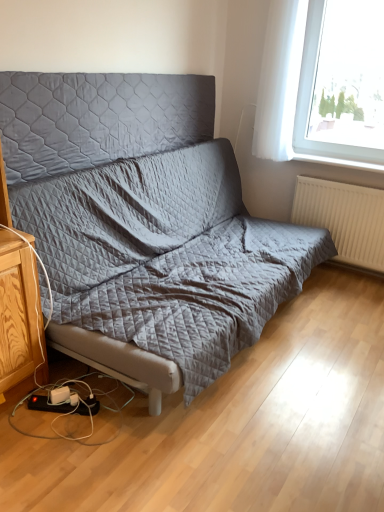
The height and width of the screenshot is (512, 384). What are the coordinates of `white sheer curtain at upper right` in the screenshot? It's located at (279, 80).

Describe the element at coordinates (344, 218) in the screenshot. I see `white textured radiator at right` at that location.

Based on the photo, what is the approximate width of quilted fabric headboard at upper center?

The width of quilted fabric headboard at upper center is 2.46 inches.

This screenshot has height=512, width=384. In order to click on quilted fabric headboard at upper center in this screenshot , I will do coord(98,118).

This screenshot has width=384, height=512. What do you see at coordinates (146, 216) in the screenshot? I see `quilted fabric studio couch at center` at bounding box center [146, 216].

What are the coordinates of `transparent glass window at upper right` in the screenshot? It's located at (296, 91).

Where is `studio couch above the black plastic power strip at lower left (from the image's perspective)`? This screenshot has height=512, width=384. studio couch above the black plastic power strip at lower left (from the image's perspective) is located at coordinates (146, 216).

Considering the relative positions of quilted fabric studio couch at center and black plastic power strip at lower left in the image provided, is quilted fabric studio couch at center to the left or to the right of black plastic power strip at lower left?

Based on their positions, quilted fabric studio couch at center is located to the right of black plastic power strip at lower left.

Looking at this image, from the image's perspective, is quilted fabric studio couch at center located above black plastic power strip at lower left?

Indeed, from the image's perspective, quilted fabric studio couch at center is shown above black plastic power strip at lower left.

Between white sheer curtain at upper right and quilted fabric studio couch at center, which one has larger size?

quilted fabric studio couch at center.

Considering the sizes of objects white sheer curtain at upper right and quilted fabric studio couch at center in the image provided, who is shorter, white sheer curtain at upper right or quilted fabric studio couch at center?

quilted fabric studio couch at center.

Would you say white sheer curtain at upper right is outside quilted fabric studio couch at center?

Absolutely, white sheer curtain at upper right is external to quilted fabric studio couch at center.

The width and height of the screenshot is (384, 512). What are the coordinates of `studio couch that is on the left side of white sheer curtain at upper right` in the screenshot? It's located at (146, 216).

Considering the relative sizes of black plastic power strip at lower left and white sheer curtain at upper right in the image provided, is black plastic power strip at lower left bigger than white sheer curtain at upper right?

No.

Is the surface of black plastic power strip at lower left in direct contact with white sheer curtain at upper right?

No, black plastic power strip at lower left is not making contact with white sheer curtain at upper right.

Which is less distant, (x=38, y=406) or (x=268, y=158)?

Point (x=38, y=406)

Is black plastic power strip at lower left oriented towards white sheer curtain at upper right?

No, black plastic power strip at lower left is not aimed at white sheer curtain at upper right.

Is the depth of white textured radiator at right greater than that of transparent glass window at upper right?

That is True.

Find the location of a particular element. This screenshot has width=384, height=512. window above the white textured radiator at right (from the image's perspective) is located at coordinates (296, 91).

From their relative heights in the image, would you say white textured radiator at right is taller or shorter than transparent glass window at upper right?

Clearly, white textured radiator at right is shorter compared to transparent glass window at upper right.

What's the angular difference between white textured radiator at right and transparent glass window at upper right's facing directions?

The angular difference between white textured radiator at right and transparent glass window at upper right is 0.000152 degrees.

Which of these two, quilted fabric studio couch at center or white textured radiator at right, is wider?

Wider between the two is quilted fabric studio couch at center.

In terms of height, does quilted fabric studio couch at center look taller or shorter compared to white textured radiator at right?

Clearly, quilted fabric studio couch at center is taller compared to white textured radiator at right.

Based on their positions, is quilted fabric studio couch at center located to the left or right of white textured radiator at right?

Based on their positions, quilted fabric studio couch at center is located to the left of white textured radiator at right.

From a real-world perspective, who is located lower, quilted fabric studio couch at center or white textured radiator at right?

From a 3D spatial view, white textured radiator at right is below.

In the scene shown: How far apart are white sheer curtain at upper right and transparent glass window at upper right?

A distance of 3.10 inches exists between white sheer curtain at upper right and transparent glass window at upper right.

In terms of height, does white sheer curtain at upper right look taller or shorter compared to transparent glass window at upper right?

In the image, white sheer curtain at upper right appears to be taller than transparent glass window at upper right.

Is white sheer curtain at upper right not within transparent glass window at upper right?

white sheer curtain at upper right lies outside transparent glass window at upper right's area.

Consider the image. From the image's perspective, does white sheer curtain at upper right appear lower than transparent glass window at upper right?

No, from the image's perspective, white sheer curtain at upper right is not below transparent glass window at upper right.

Considering the relative sizes of white sheer curtain at upper right and black plastic power strip at lower left in the image provided, is white sheer curtain at upper right thinner than black plastic power strip at lower left?

Yes, white sheer curtain at upper right is thinner than black plastic power strip at lower left.

Where is `curtain lying on the right of black plastic power strip at lower left`? curtain lying on the right of black plastic power strip at lower left is located at coordinates (279, 80).

Is white sheer curtain at upper right inside the boundaries of black plastic power strip at lower left, or outside?

white sheer curtain at upper right exists outside the volume of black plastic power strip at lower left.

Is white sheer curtain at upper right touching black plastic power strip at lower left?

No.

Locate an element on the screen. The height and width of the screenshot is (512, 384). studio couch above the black plastic power strip at lower left (from the image's perspective) is located at coordinates pyautogui.click(x=146, y=216).

The width and height of the screenshot is (384, 512). In the image, there is a white sheer curtain at upper right. What are the coordinates of `studio couch below it (from a real-world perspective)` in the screenshot? It's located at (146, 216).

Which object lies further to the anchor point transparent glass window at upper right, black plastic power strip at lower left or white sheer curtain at upper right?

Based on the image, black plastic power strip at lower left appears to be further to transparent glass window at upper right.

Which object lies nearer to the anchor point quilted fabric studio couch at center, black plastic power strip at lower left or transparent glass window at upper right?

transparent glass window at upper right.

From the picture: Based on their spatial positions, is quilted fabric headboard at upper center or white textured radiator at right further from white sheer curtain at upper right?

quilted fabric headboard at upper center lies further to white sheer curtain at upper right than the other object.

When comparing their distances from white textured radiator at right, does quilted fabric headboard at upper center or white sheer curtain at upper right seem closer?

The object closer to white textured radiator at right is white sheer curtain at upper right.

Considering their positions, is quilted fabric headboard at upper center positioned further to transparent glass window at upper right than quilted fabric studio couch at center?

The object further to transparent glass window at upper right is quilted fabric studio couch at center.

Estimate the real-world distances between objects in this image. Which object is closer to quilted fabric headboard at upper center, transparent glass window at upper right or black plastic power strip at lower left?

transparent glass window at upper right lies closer to quilted fabric headboard at upper center than the other object.

Looking at the image, which one is located further to white sheer curtain at upper right, quilted fabric headboard at upper center or black plastic power strip at lower left?

The object further to white sheer curtain at upper right is black plastic power strip at lower left.

Which object lies nearer to the anchor point quilted fabric studio couch at center, black plastic power strip at lower left or white sheer curtain at upper right?

white sheer curtain at upper right.

I want to click on window between white sheer curtain at upper right and white textured radiator at right in the up-down direction, so click(296, 91).

At what (x,y) coordinates should I click in order to perform the action: click on curtain between quilted fabric headboard at upper center and white textured radiator at right. Please return your answer as a coordinate pair (x, y). This screenshot has width=384, height=512. Looking at the image, I should click on (279, 80).

Identify the location of studio couch between transparent glass window at upper right and black plastic power strip at lower left in the up-down direction. (146, 216).

What are the coordinates of `radiator between white sheer curtain at upper right and black plastic power strip at lower left in the up-down direction` in the screenshot? It's located at (344, 218).